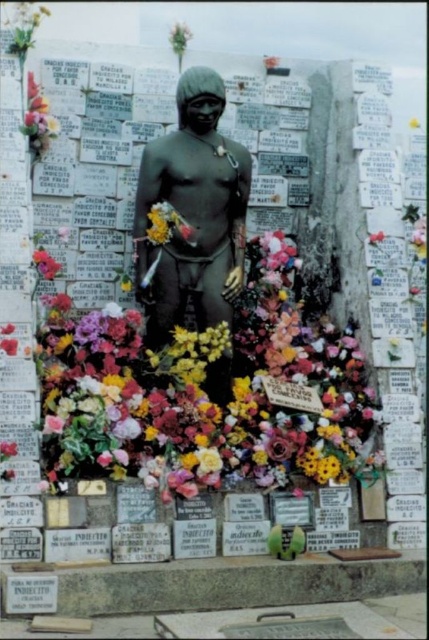
You are a florist arranging a memorial display. You have two items to place in the scene described. The fluffy silk flowers at center and the floral bouquet at upper left. Which of these two items is bigger in size?

The fluffy silk flowers at center is larger in size than the floral bouquet at upper left.

In the scene shown: You are a florist arranging a memorial display. You have the fluffy silk flowers at center and the floral bouquet at upper left. Based on the scene, where should you place the floral bouquet to maintain the existing arrangement?

The floral bouquet at upper left should be placed above the fluffy silk flowers at center to maintain the existing arrangement since the fluffy silk flowers at center is below the floral bouquet at upper left.